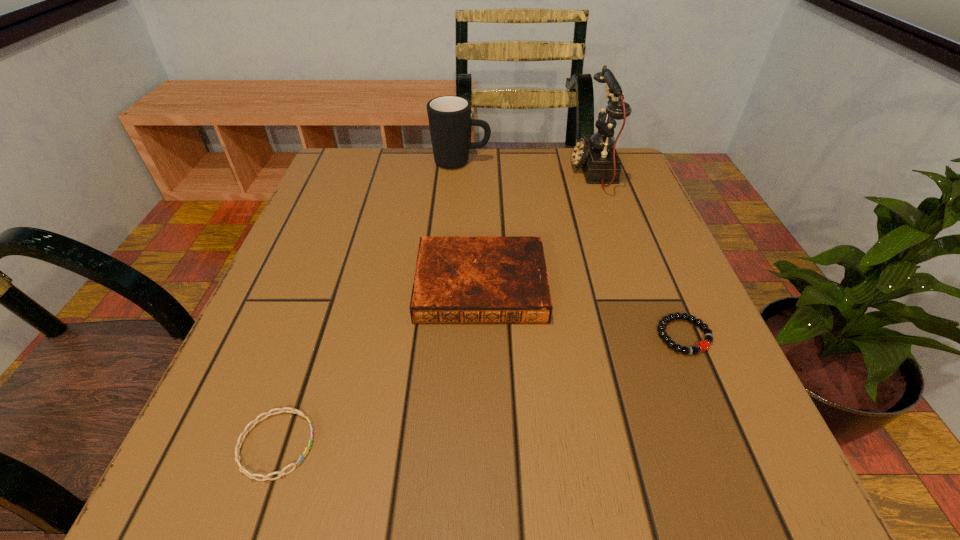
In order to click on free space that is in between the mug and the right bracelet in this screenshot , I will do `click(572, 249)`.

You are a GUI agent. You are given a task and a screenshot of the screen. Output one action in this format:
    pyautogui.click(x=<x>, y=<y>)
    Task: Click on the vacant space that's between the leftmost object and the fourth shortest object
    The height and width of the screenshot is (540, 960).
    Given the screenshot: What is the action you would take?
    pyautogui.click(x=369, y=303)

You are a GUI agent. You are given a task and a screenshot of the screen. Output one action in this format:
    pyautogui.click(x=<x>, y=<y>)
    Task: Click on the vacant point located between the tallest object and the farther bracelet
    The width and height of the screenshot is (960, 540).
    Given the screenshot: What is the action you would take?
    pyautogui.click(x=638, y=253)

This screenshot has height=540, width=960. I want to click on unoccupied area between the mug and the right bracelet, so click(572, 249).

Identify the location of free space between the tallest object and the farther bracelet. (638, 253).

Identify which object is the second nearest to the tallest object. Please provide its 2D coordinates. Your answer should be formatted as a tuple, i.e. [(x, y)], where the tuple contains the x and y coordinates of a point satisfying the conditions above.

[(458, 279)]

Identify the location of object that is the second nearest to the telephone. The width and height of the screenshot is (960, 540). (458, 279).

Find the location of a particular element. vacant region that satisfies the following two spatial constraints: 1. on the spine side of the Bible; 2. on the surface of the leftmost object showing star-shaped elements is located at coordinates pyautogui.click(x=481, y=444).

What are the coordinates of `vacant space that satisfies the following two spatial constraints: 1. on the spine side of the right bracelet; 2. on the left side of the Bible` in the screenshot? It's located at (481, 336).

This screenshot has height=540, width=960. Find the location of `vacant region that satisfies the following two spatial constraints: 1. on the spine side of the Bible; 2. on the right side of the right bracelet`. vacant region that satisfies the following two spatial constraints: 1. on the spine side of the Bible; 2. on the right side of the right bracelet is located at coordinates (481, 336).